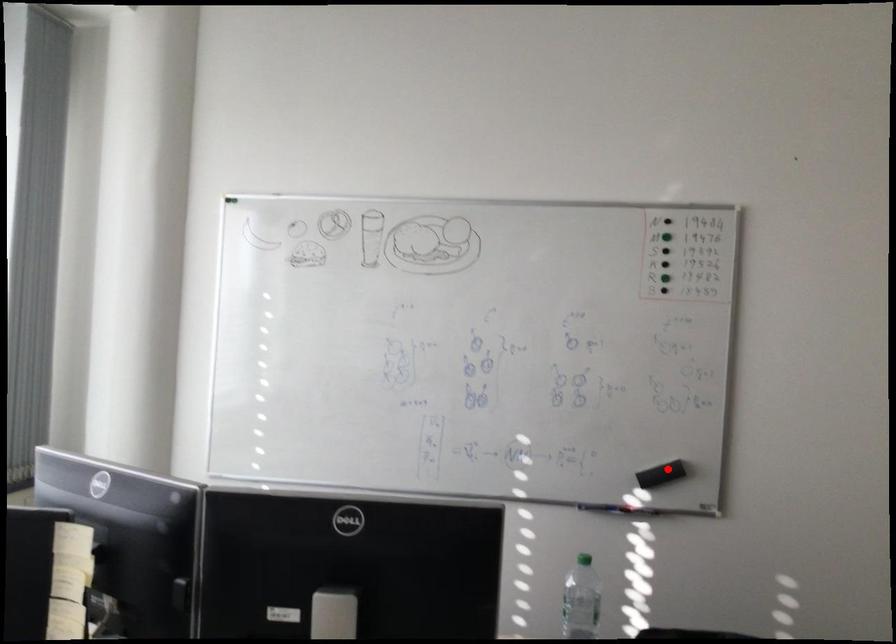
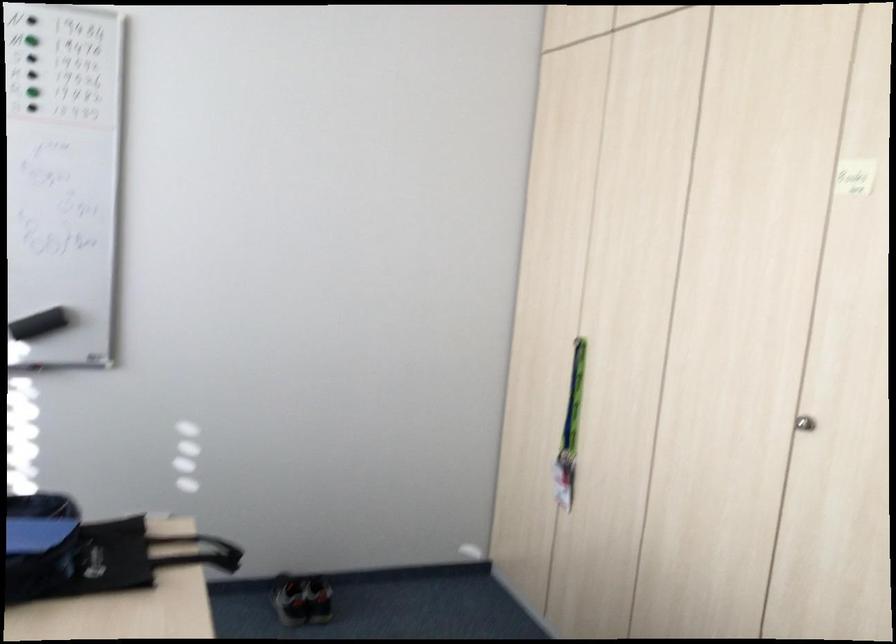
Question: I am providing you with two images of the same scene from different viewpoints. Image1 has a red point marked. In image2, the corresponding 3D location appears at what relative position? Reply with the corresponding letter.

Choices:
 (A) Closer
 (B) Farther

Answer: (A)